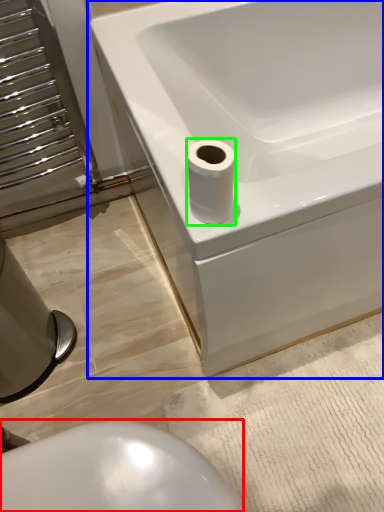
Question: Which is nearer to the bidet (highlighted by a red box)? bathtub (highlighted by a blue box) or toilet paper (highlighted by a green box).

Choices:
 (A) bathtub
 (B) toilet paper

Answer: (B)